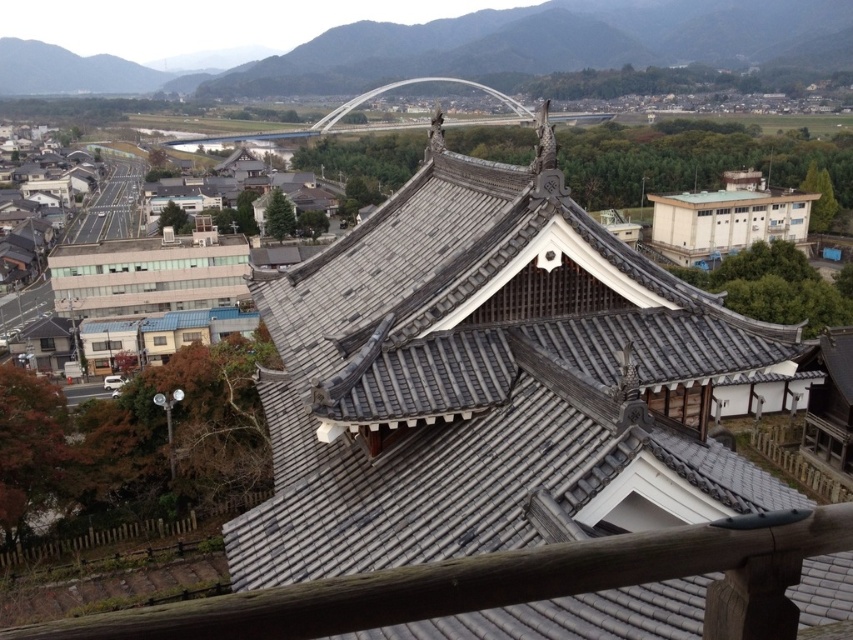
Is point (612, 432) farther from camera compared to point (514, 65)?

No.

Find the location of a particular element. The image size is (853, 640). gray tile roof at center is located at coordinates (490, 384).

Can you confirm if wooden at center is smaller than white concrete building at center-right?

Yes.

Does point (171, 620) lie in front of point (672, 195)?

Yes.

In order to click on wooden at center in this screenshot , I will do `click(511, 584)`.

Does gray tile roof at center have a lesser height compared to wooden at center?

In fact, gray tile roof at center may be taller than wooden at center.

Between point (473, 166) and point (799, 550), which one is positioned behind?

The point (473, 166) is behind.

Image resolution: width=853 pixels, height=640 pixels. Identify the location of gray tile roof at center. (490, 384).